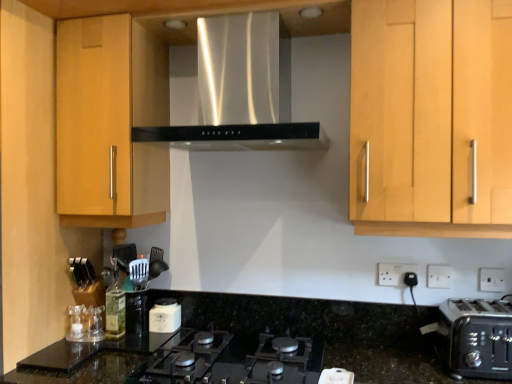
Locate an element on the screen. free point above stainless steel range hood at center (from a real-world perspective) is located at coordinates (245, 12).